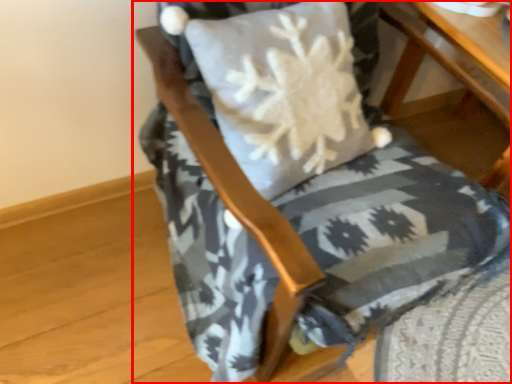
Question: From the image's perspective, where is chair (annotated by the red box) located relative to table?

Choices:
 (A) above
 (B) below

Answer: (B)